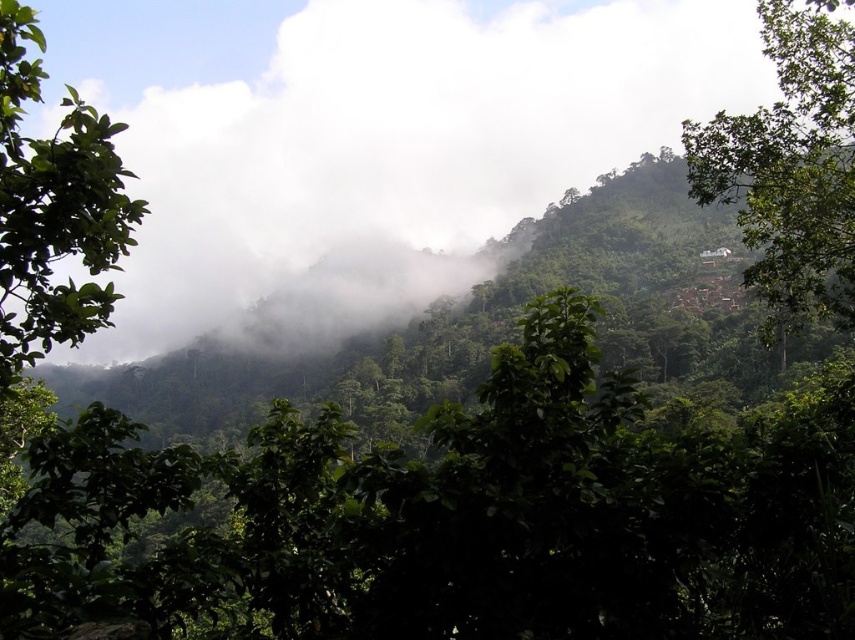
From the picture: You are an environmental scientist studying the vegetation in this tropical landscape. You observe the green leafy tree at upper right and the green leafy tree at left. Which tree has a smaller trunk diameter?

The green leafy tree at upper right has a smaller trunk diameter than the green leafy tree at left.

You are a drone operator trying to capture a photo of the white fluffy cloud at upper center. The drone must stay within the rectangular area defined by coordinates from point A at lower left corner to point B at upper right corner. The coordinates of point A are at 0.0, 0.0 and point B are at 0.5, 0.5. Will the drone be able to capture the cloud within this area?

The white fluffy cloud at upper center is located at point (369, 138). Since point A is at (0, 0) and point B is at (427, 320), the cloud is within the rectangular area defined by these coordinates. Therefore, the drone can capture the cloud within this area.

You are an observer in the lush landscape. You notice the white fluffy cloud at upper center and the green leafy tree at left. Which object appears taller in the image?

The white fluffy cloud at upper center appears taller than the green leafy tree at left.